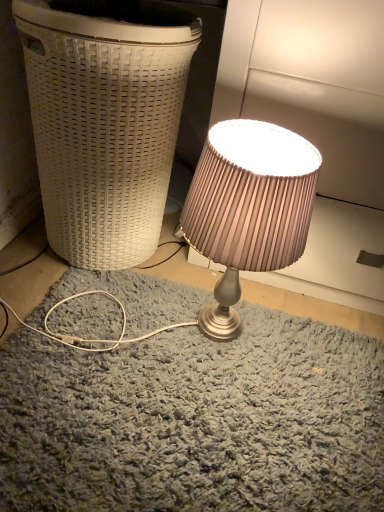
The height and width of the screenshot is (512, 384). In order to click on white woven basket at left in this screenshot , I will do `click(105, 121)`.

This screenshot has height=512, width=384. Describe the element at coordinates (105, 121) in the screenshot. I see `white woven basket at left` at that location.

What is the approximate height of satin pink lampshade at center?

The height of satin pink lampshade at center is 18.29 inches.

In order to face satin pink lampshade at center, should I rotate leftwards or rightwards?

Turn right approximately 6.567 degrees to face it.

Find the location of a particular element. This screenshot has width=384, height=512. satin pink lampshade at center is located at coordinates (248, 208).

This screenshot has width=384, height=512. Describe the element at coordinates (248, 208) in the screenshot. I see `satin pink lampshade at center` at that location.

The image size is (384, 512). In order to click on white woven basket at left in this screenshot , I will do `click(105, 121)`.

Consider the image. Considering the positions of objects satin pink lampshade at center and white woven basket at left in the image provided, who is more to the right, satin pink lampshade at center or white woven basket at left?

From the viewer's perspective, satin pink lampshade at center appears more on the right side.

Between satin pink lampshade at center and white woven basket at left, which one is positioned behind?

white woven basket at left is further from the camera.

Is point (254, 152) farther from viewer compared to point (188, 23)?

No, (254, 152) is closer to viewer.

From the image's perspective, is satin pink lampshade at center above or below white woven basket at left?

satin pink lampshade at center is situated lower than white woven basket at left in the image.

From a real-world perspective, who is located lower, satin pink lampshade at center or white woven basket at left?

satin pink lampshade at center is physically lower.

Considering the sizes of satin pink lampshade at center and white woven basket at left in the image, is satin pink lampshade at center wider or thinner than white woven basket at left?

satin pink lampshade at center is thinner than white woven basket at left.

Is satin pink lampshade at center shorter than white woven basket at left?

Yes, satin pink lampshade at center is shorter than white woven basket at left.

Can you confirm if satin pink lampshade at center is smaller than white woven basket at left?

Correct, satin pink lampshade at center occupies less space than white woven basket at left.

Which is correct: satin pink lampshade at center is inside white woven basket at left, or outside of it?

satin pink lampshade at center is outside white woven basket at left.

Can you see satin pink lampshade at center touching white woven basket at left?

satin pink lampshade at center is not next to white woven basket at left, and they're not touching.

Is satin pink lampshade at center oriented towards white woven basket at left?

No, satin pink lampshade at center is not aimed at white woven basket at left.

Can you tell me how much satin pink lampshade at center and white woven basket at left differ in facing direction?

They differ by 0.742 degrees in their facing directions.

Find the location of a particular element. lamp that is on the right side of white woven basket at left is located at coordinates (248, 208).

Between white woven basket at left and satin pink lampshade at center, which one appears on the left side from the viewer's perspective?

Positioned to the left is white woven basket at left.

In the image, is white woven basket at left positioned in front of or behind satin pink lampshade at center?

white woven basket at left is behind satin pink lampshade at center.

Is point (142, 191) closer to viewer compared to point (266, 184)?

No, it is not.

From the image's perspective, which is above, white woven basket at left or satin pink lampshade at center?

white woven basket at left, from the image's perspective.

From a real-world perspective, which is physically above, white woven basket at left or satin pink lampshade at center?

white woven basket at left is physically above.

Which of these two, white woven basket at left or satin pink lampshade at center, is thinner?

Thinner between the two is satin pink lampshade at center.

Does white woven basket at left have a greater height compared to satin pink lampshade at center?

Indeed, white woven basket at left has a greater height compared to satin pink lampshade at center.

Considering the sizes of objects white woven basket at left and satin pink lampshade at center in the image provided, who is smaller, white woven basket at left or satin pink lampshade at center?

satin pink lampshade at center is smaller.

Is satin pink lampshade at center inside white woven basket at left?

No, satin pink lampshade at center is located outside of white woven basket at left.

Is white woven basket at left touching satin pink lampshade at center?

No, white woven basket at left is not with satin pink lampshade at center.

Could you tell me if white woven basket at left is turned towards satin pink lampshade at center?

No.

The height and width of the screenshot is (512, 384). I want to click on lamp on the right of the white woven basket at left, so click(x=248, y=208).

The height and width of the screenshot is (512, 384). Find the location of `waste container that is on the left side of satin pink lampshade at center`. waste container that is on the left side of satin pink lampshade at center is located at coordinates (105, 121).

Locate an element on the screen. The height and width of the screenshot is (512, 384). lamp below the white woven basket at left (from the image's perspective) is located at coordinates (248, 208).